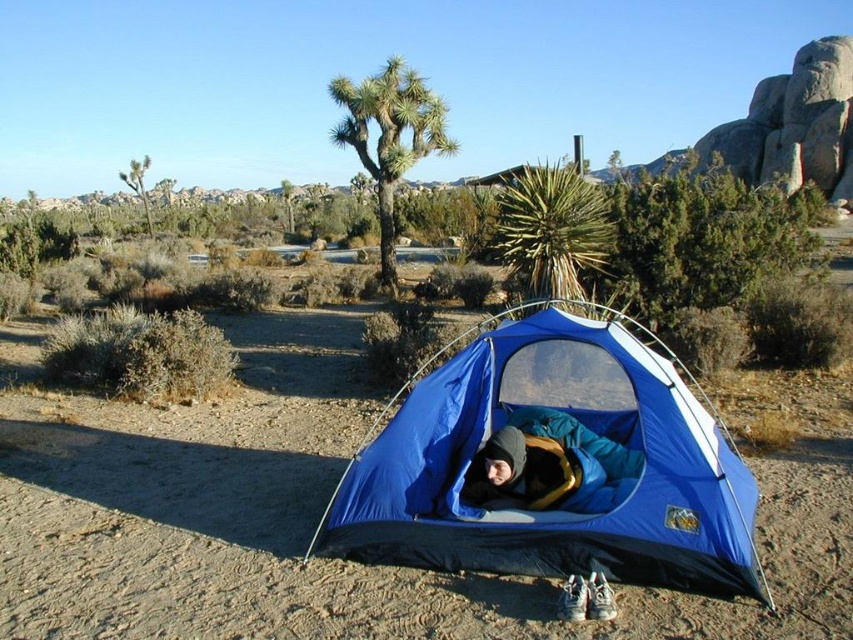
Question: Observing the image, what is the correct spatial positioning of blue fabric tent at center in reference to blue fabric sleeping bag at center?

Choices:
 (A) left
 (B) right

Answer: (A)

Question: Which of the following is the farthest from the observer?

Choices:
 (A) (541, 438)
 (B) (593, 304)

Answer: (B)

Question: Where is blue fabric tent at center located in relation to blue fabric sleeping bag at center in the image?

Choices:
 (A) above
 (B) below

Answer: (A)

Question: Which object appears farthest from the camera in this image?

Choices:
 (A) blue fabric sleeping bag at center
 (B) blue fabric tent at center

Answer: (A)

Question: Can you confirm if blue fabric tent at center is wider than blue fabric sleeping bag at center?

Choices:
 (A) yes
 (B) no

Answer: (A)